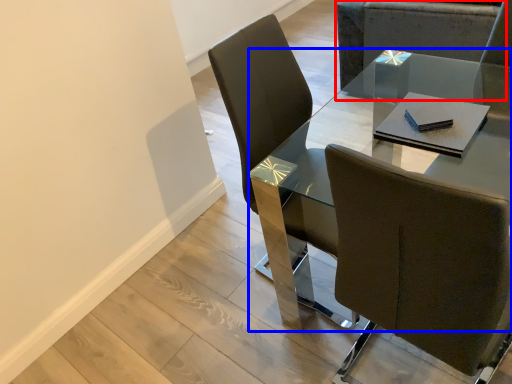
Question: Which object is closer to the camera taking this photo, chair (highlighted by a red box) or table (highlighted by a blue box)?

Choices:
 (A) chair
 (B) table

Answer: (B)